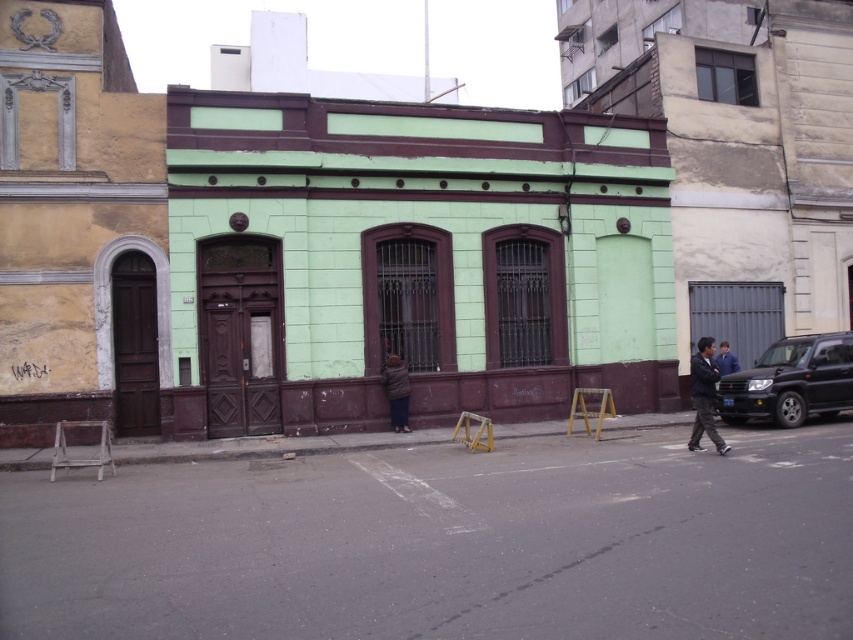
You are driving a black matte suv at right and want to park it in front of the building. The sidewalk has two yellow construction barriers. Is there enough space between the barriers to park the suv?

The distance between the barriers is 15.90 meters, which is more than enough space to park the black matte suv at right between them.

In the scene shown: You are a delivery person with a cart that is 1.5 meters wide. You need to navigate between the black matte suv at right and the dark blue jacket at lower right to reach the sidewalk. Can your cart fit through the space between them?

The black matte suv at right is 4.75 meters from the dark blue jacket at lower right. Since your cart is only 1.5 meters wide, there is sufficient space for it to pass through the 4.75 meter gap between the two objects.

You are a delivery driver who needs to park your black matte suv at right as close as possible to the building without blocking the sidewalk. Based on the scene, where should you position your vehicle?

The black matte suv at right should be positioned at point (791,381) to park as close as possible to the building without blocking the sidewalk.